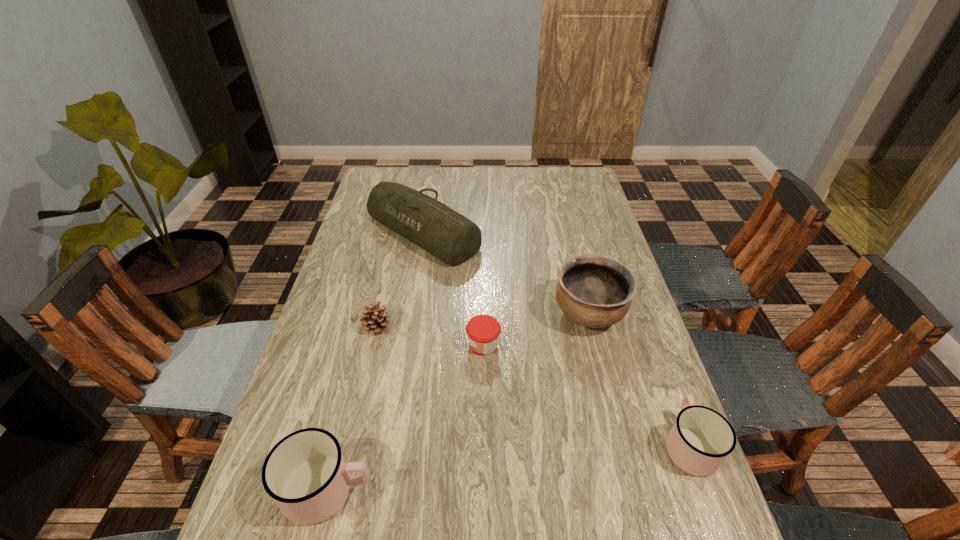
Locate an element on the screen. free space between the jam and the right mug is located at coordinates (587, 395).

The height and width of the screenshot is (540, 960). In order to click on free space between the fourth shortest object and the shortest object in this screenshot , I will do `click(405, 417)`.

Where is `free space between the shorter mug and the pinecone`? This screenshot has height=540, width=960. free space between the shorter mug and the pinecone is located at coordinates (533, 385).

This screenshot has width=960, height=540. I want to click on vacant space that's between the pinecone and the right mug, so click(x=533, y=385).

Identify the location of free area in between the jam and the pottery. The height and width of the screenshot is (540, 960). (537, 329).

This screenshot has height=540, width=960. Find the location of `free spot between the shortest object and the pinecone`. free spot between the shortest object and the pinecone is located at coordinates (430, 335).

You are a GUI agent. You are given a task and a screenshot of the screen. Output one action in this format:
    pyautogui.click(x=<x>, y=<y>)
    Task: Click on the vacant space that's between the pottery and the farthest object
    Image resolution: width=960 pixels, height=540 pixels.
    Given the screenshot: What is the action you would take?
    pyautogui.click(x=506, y=273)

Where is `free space between the shorter mug and the pinecone`? This screenshot has width=960, height=540. free space between the shorter mug and the pinecone is located at coordinates (533, 385).

I want to click on vacant space in between the pottery and the shorter mug, so click(639, 379).

Locate which object ranks second in proximity to the farthest object. Please provide its 2D coordinates. Your answer should be formatted as a tuple, i.e. [(x, y)], where the tuple contains the x and y coordinates of a point satisfying the conditions above.

[(595, 291)]